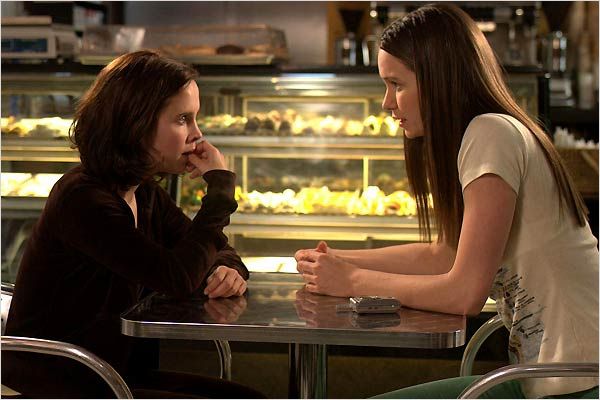
Locate an element on the screen. This screenshot has width=600, height=400. wall is located at coordinates (308, 40).